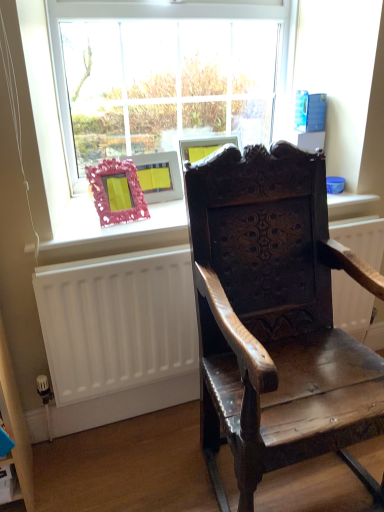
This screenshot has width=384, height=512. What are the coordinates of `vacant space to the right of pink textured frame at window` in the screenshot? It's located at (166, 209).